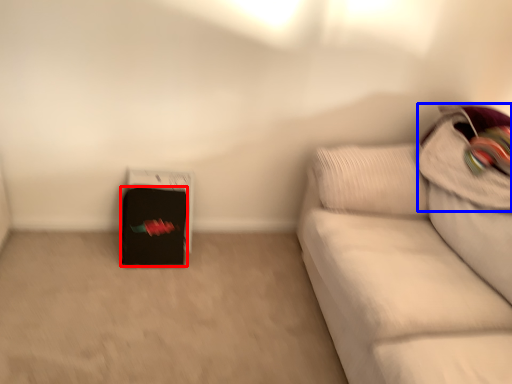
Question: Among these objects, which one is nearest to the camera, luggage (highlighted by a red box) or pillow (highlighted by a blue box)?

Choices:
 (A) luggage
 (B) pillow

Answer: (B)